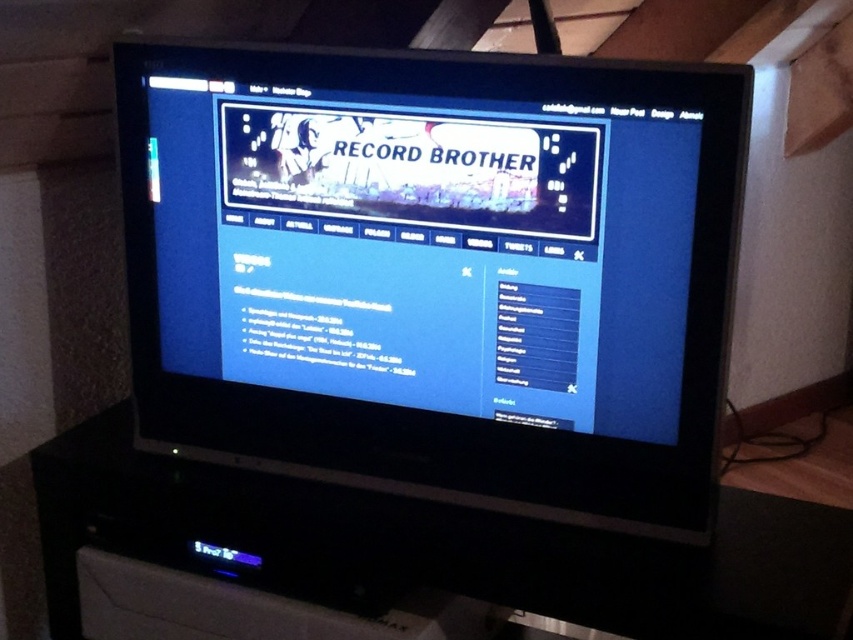
You are setting up a home office and want to place both the black glossy monitor at center and the black plastic entertainment center at center on a desk. Given their sizes, which one should you place first to ensure they both fit?

The black glossy monitor at center occupies less space than the black plastic entertainment center at center, so you should place the black plastic entertainment center at center first to ensure it fits properly before placing the smaller monitor.

You are looking at the webpage on the television screen. There are two points marked on the screen, one at coordinates point (292,426) and the other at point (292,573). Which point is closer to the edge of the screen?

Point (292,573) is closer to the edge of the screen because it has a higher x coordinate, meaning it is further to the right on the screen.

You are standing in front of the black glossy monitor at center and want to reach the black plastic entertainment center at center. Can you easily access it without moving the monitor?

The black plastic entertainment center at center is behind the black glossy monitor at center, so you cannot easily access it without moving the monitor.